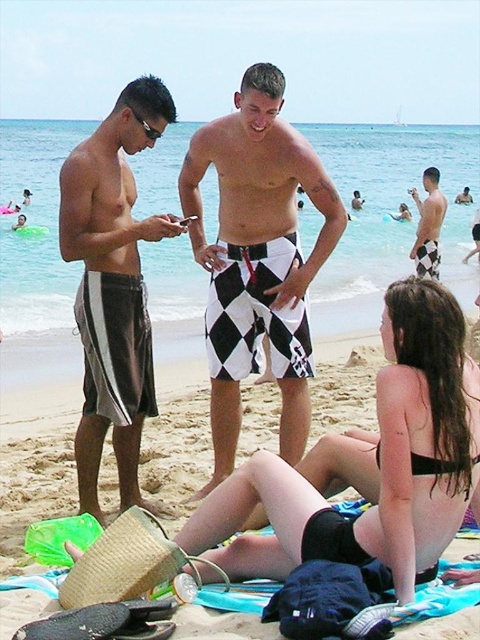
You are a photographer standing at the edge of the beach. You want to take a photo of the black matte bikini bottom at lower center and the checkered shorts at center. The minimum distance required for your camera to focus both objects clearly is 25 feet. Can you capture both objects in focus from your current position?

The black matte bikini bottom at lower center is 26.70 feet away from the checkered shorts at center. Since the minimum focusing distance required is 25 feet and the distance between them is greater than that, your camera can focus both objects clearly from your current position.

From the picture: You are a photographer trying to capture a candid shot of the two men on the beach. You want to ensure that the man in the brown striped shorts at left is on the left side of the photo and the man in the black checkered shorts at center is on the right side. Based on their current positions, is this possible?

Yes, because the black checkered shorts at center is positioned on the right side of brown striped shorts at left, aligning with your desired composition.